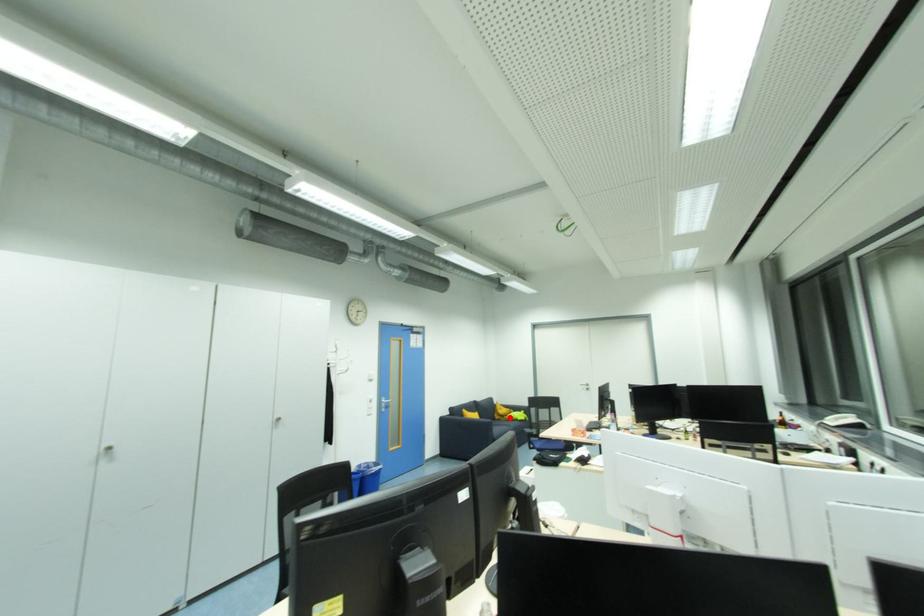
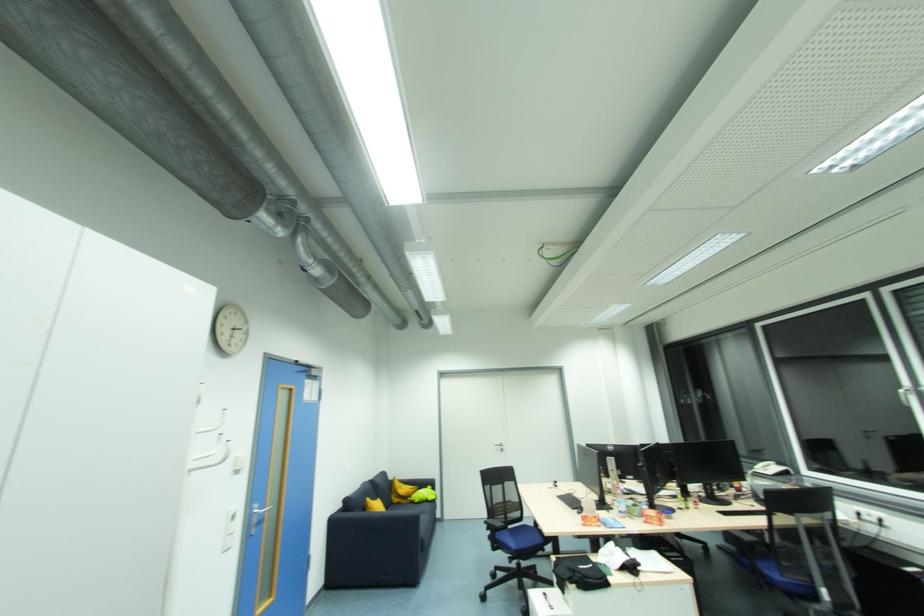
In the second image, find the point that corresponds to the highlighted location in the first image.

(412, 499)